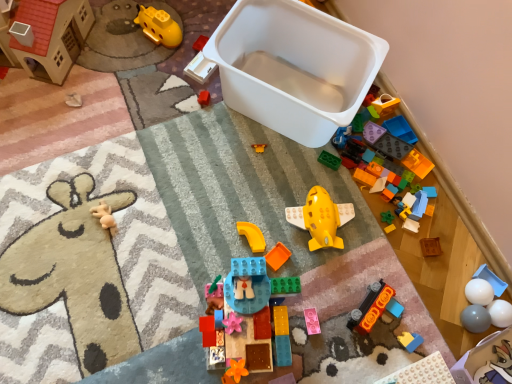
The image size is (512, 384). Find the location of `unoccupied area in front of yellow matte airplane at center, the 8th toy from the left`. unoccupied area in front of yellow matte airplane at center, the 8th toy from the left is located at coordinates (318, 292).